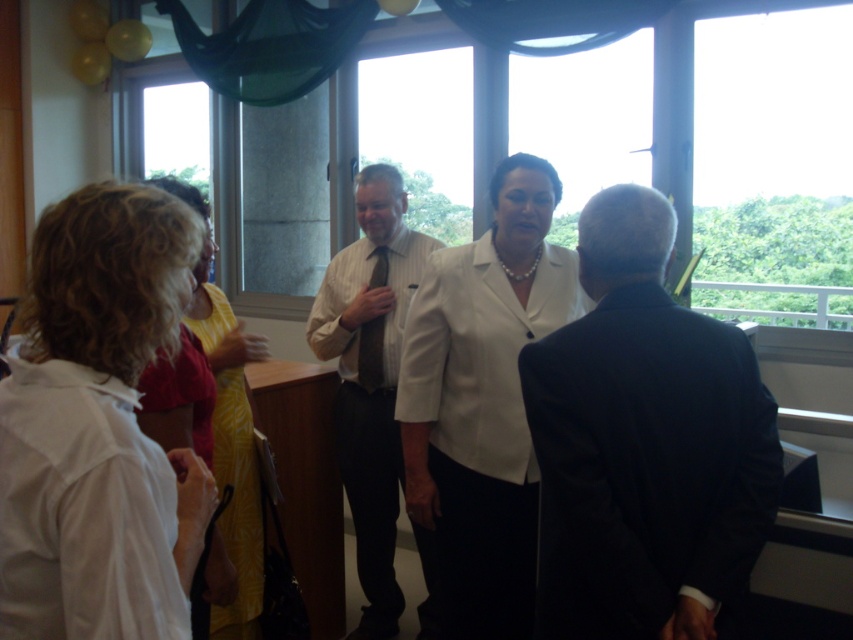
You are an interior designer assessing the layout of this room. You notice the transparent glass window at center and the white matte blazer at center. Which object is located to the left of the other?

The transparent glass window at center is positioned on the right side of white matte blazer at center, so the white matte blazer at center is to the left of the transparent glass window at center.

Looking at this image, you are attending a formal event and notice the transparent glass window at center and the yellow floral dress at left in the scene. Which object is located to the right of the other?

The transparent glass window at center is positioned on the right side of yellow floral dress at left, so the window is to the right of the dress.

You are standing in the room and want to walk from point (796, 51) to point (229, 476). Which direction should you move relative to the window?

You should move towards the window because point (229, 476) is closer to the window than point (796, 51).